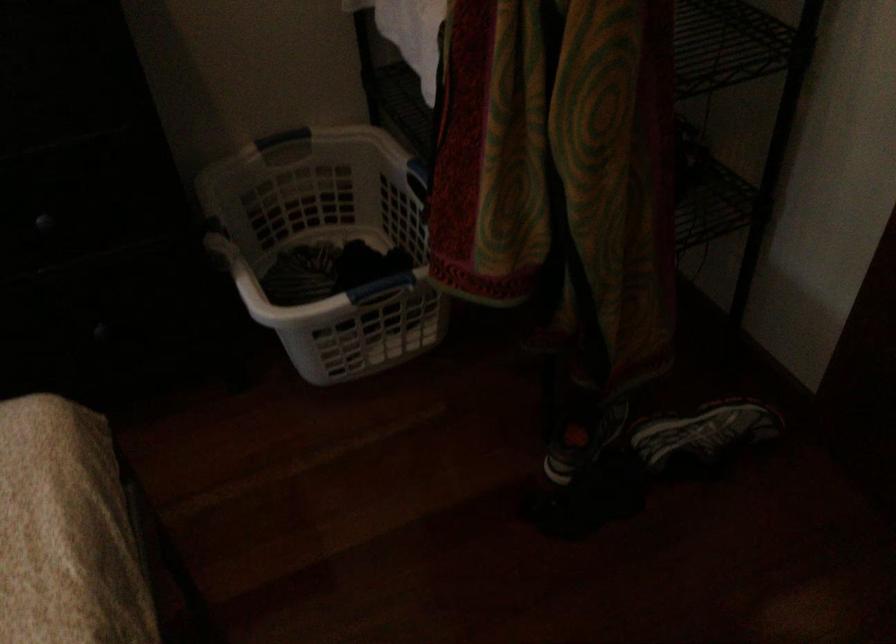
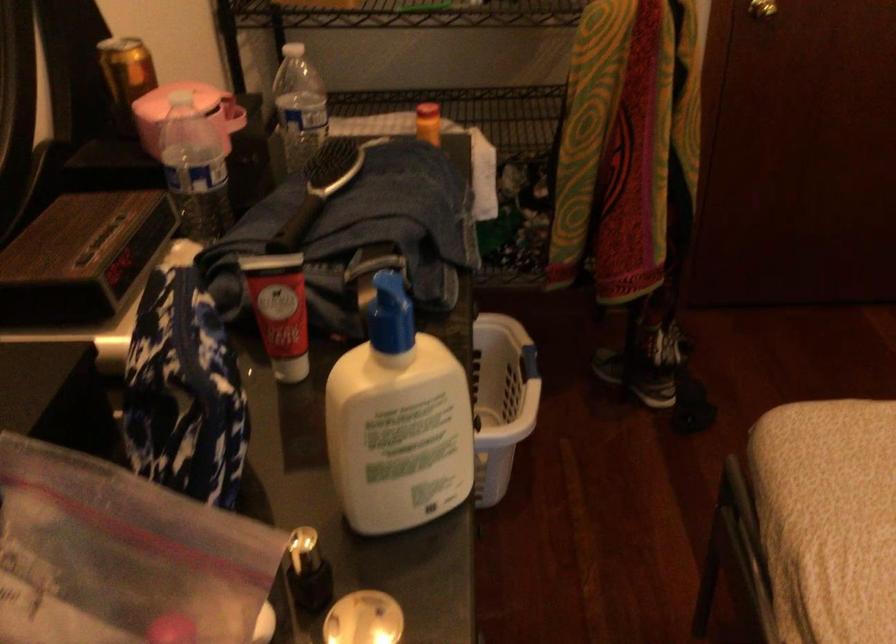
Find the pixel in the second image that matches (377,279) in the first image.

(529, 363)